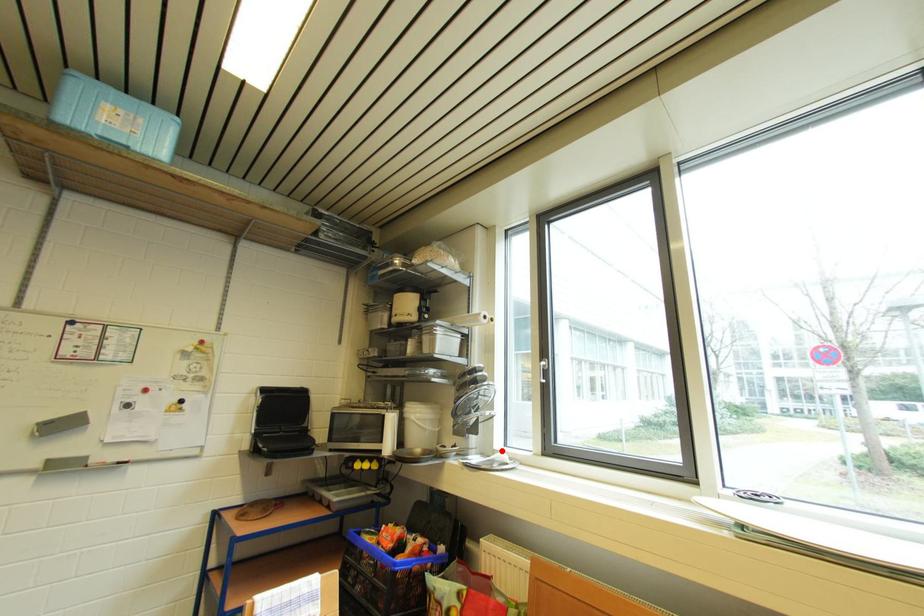
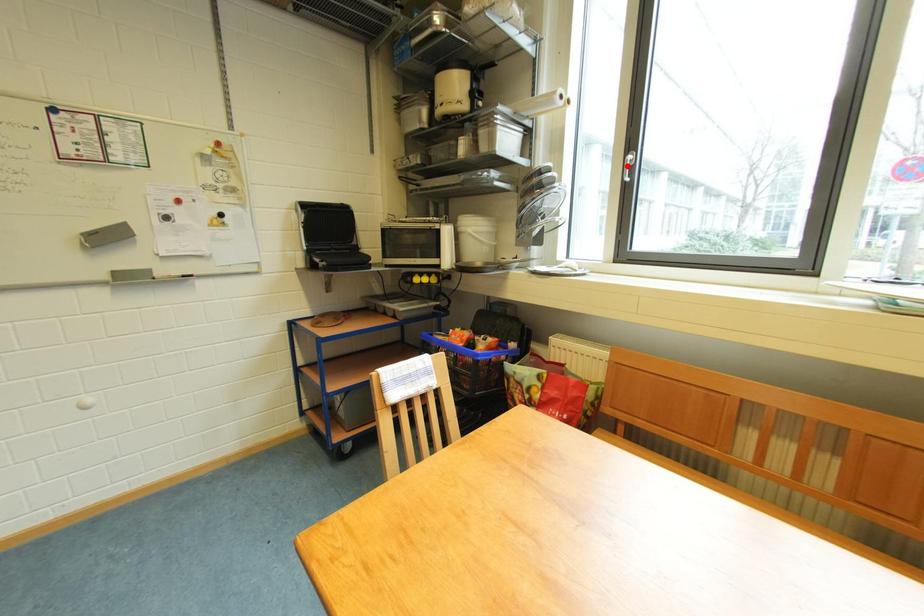
I am providing you with two images of the same scene from different viewpoints. A red point is marked on the first image and another point is marked on the second image. Do the highlighted points in image1 and image2 indicate the same real-world spot?

No